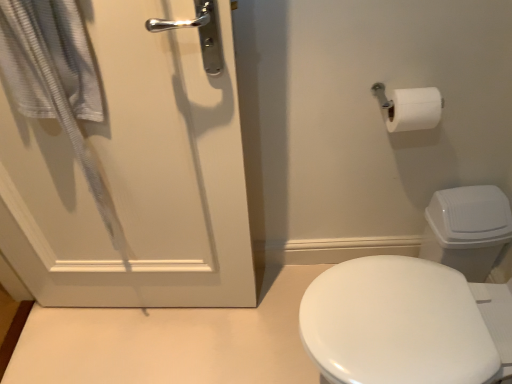
Question: Is white textured towel at left wider or thinner than white plastic toilet bowl at right?

Choices:
 (A) wide
 (B) thin

Answer: (B)

Question: Is white textured towel at left taller or shorter than white plastic toilet bowl at right?

Choices:
 (A) short
 (B) tall

Answer: (B)

Question: Which of these objects is positioned closest to the white matte door at left?

Choices:
 (A) white plastic toilet bowl at right
 (B) white textured towel at left

Answer: (B)

Question: Estimate the real-world distances between objects in this image. Which object is farther from the white textured towel at left?

Choices:
 (A) white plastic toilet bowl at right
 (B) white matte door at left

Answer: (A)